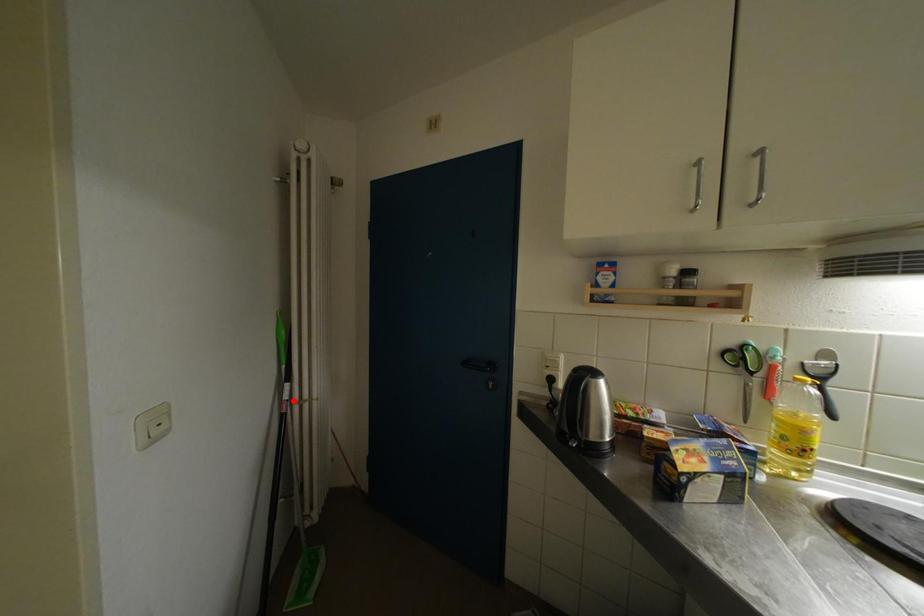
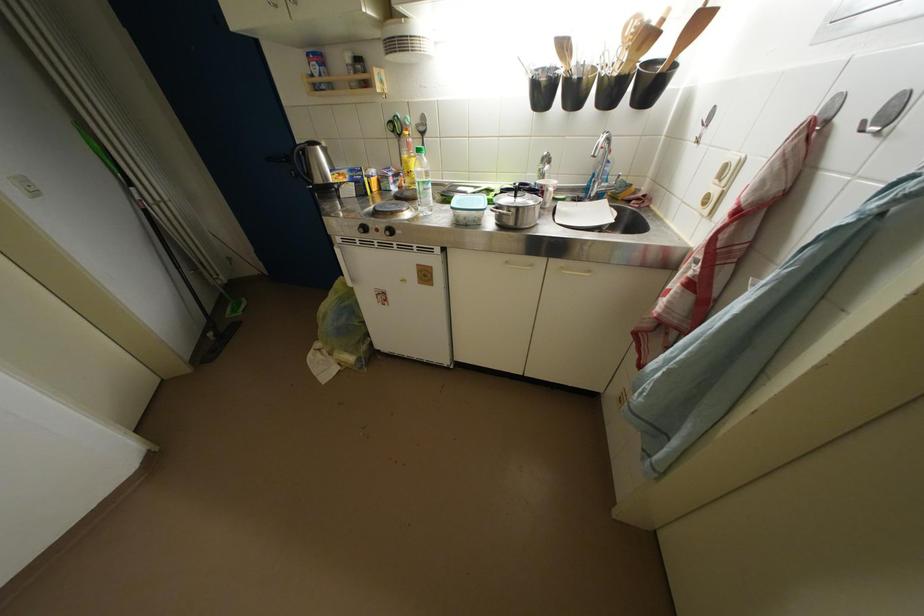
The point at the highlighted location is marked in the first image. Where is the corresponding point in the second image?

(144, 201)